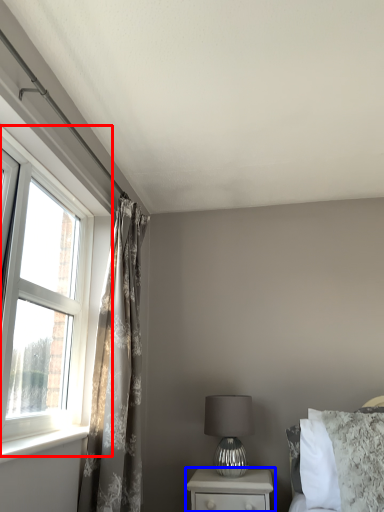
Question: Among these objects, which one is farthest to the camera, window (highlighted by a red box) or nightstand (highlighted by a blue box)?

Choices:
 (A) window
 (B) nightstand

Answer: (B)